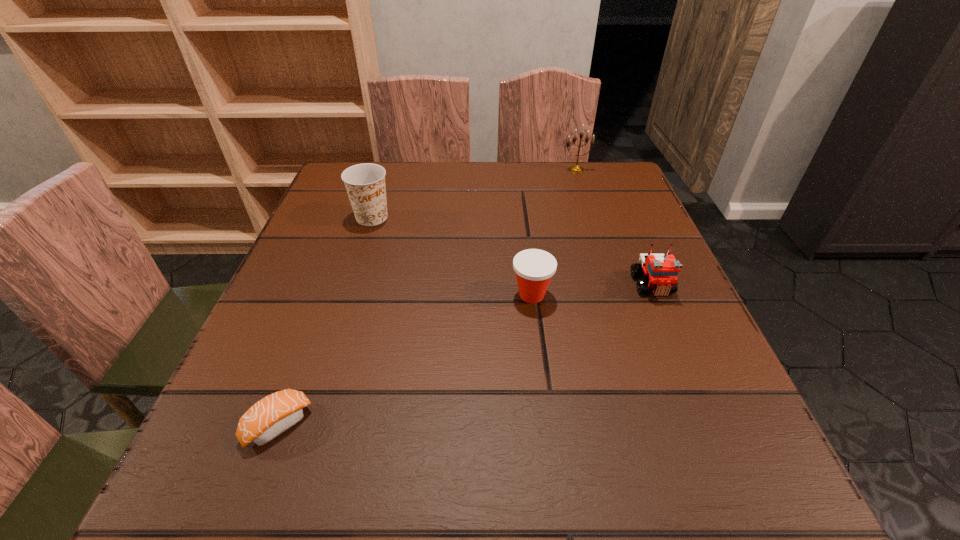
Point out which object is positioned as the nearest to the rightmost object. Please provide its 2D coordinates. Your answer should be formatted as a tuple, i.e. [(x, y)], where the tuple contains the x and y coordinates of a point satisfying the conditions above.

[(534, 268)]

You are a GUI agent. You are given a task and a screenshot of the screen. Output one action in this format:
    pyautogui.click(x=<x>, y=<y>)
    Task: Click on the object that ranks as the second closest to the Lego
    
    Given the screenshot: What is the action you would take?
    pyautogui.click(x=575, y=168)

Image resolution: width=960 pixels, height=540 pixels. Identify the location of free spot that satisfies the following two spatial constraints: 1. on the front side of the right Dixie cup; 2. on the right side of the taller Dixie cup. (348, 295).